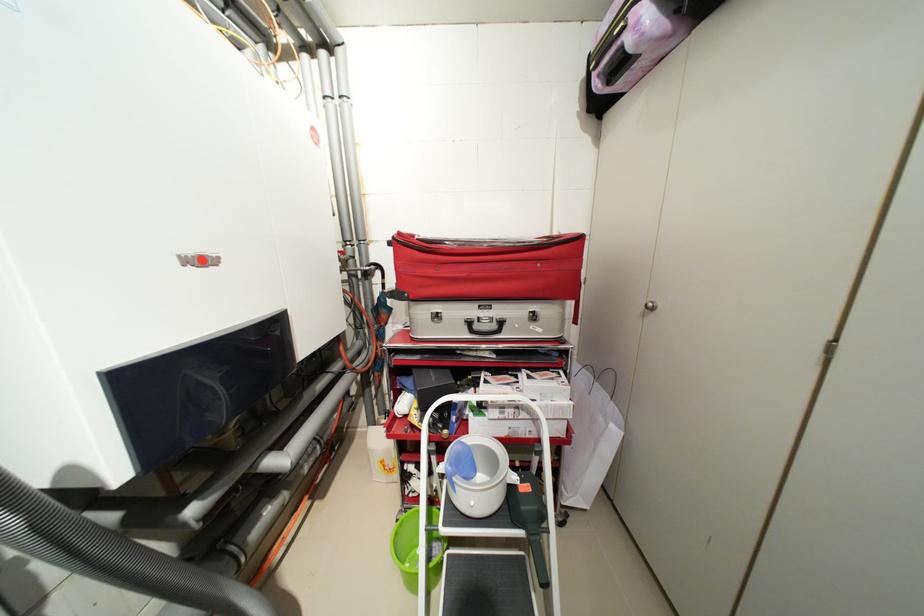
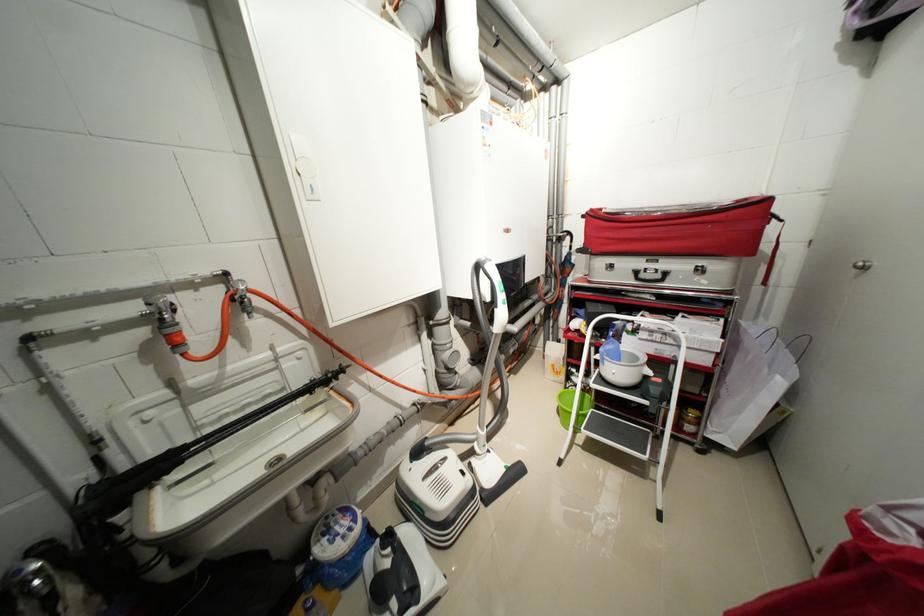
Find the pixel in the second image that matches (x=404, y=535) in the first image.

(566, 397)